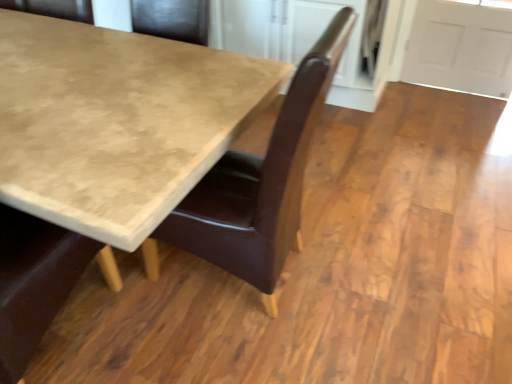
You are a GUI agent. You are given a task and a screenshot of the screen. Output one action in this format:
    pyautogui.click(x=<x>, y=<y>)
    Task: Click on the unoccupied region to the right of brown leather chair at center
    
    Given the screenshot: What is the action you would take?
    pyautogui.click(x=357, y=274)